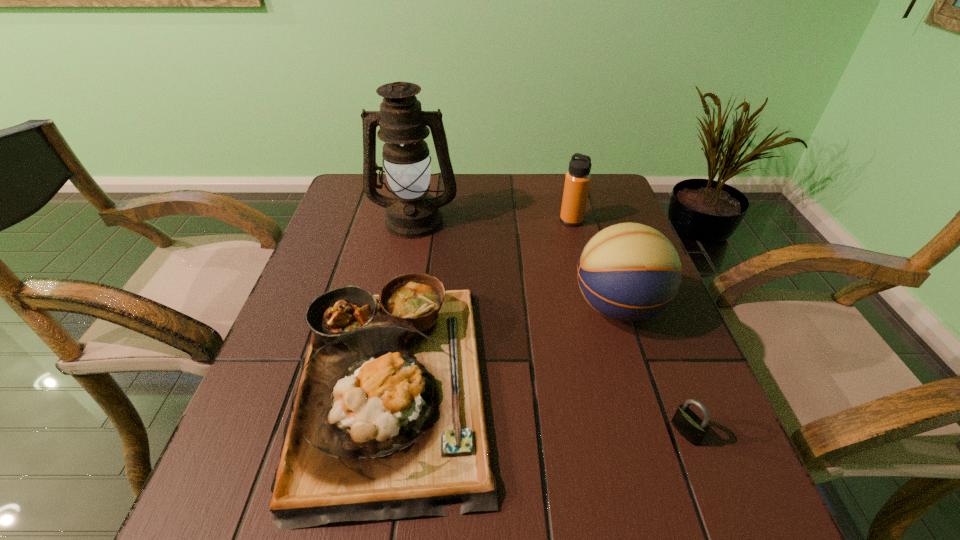
The width and height of the screenshot is (960, 540). What are the coordinates of `free space that satisfies the following two spatial constraints: 1. on the back side of the padlock; 2. on the patterned surface of the basketball` in the screenshot? It's located at (639, 307).

Find the location of `vacant area that satisfies the following two spatial constraints: 1. on the patterned surface of the padlock; 2. on the left side of the basketball`. vacant area that satisfies the following two spatial constraints: 1. on the patterned surface of the padlock; 2. on the left side of the basketball is located at coordinates pyautogui.click(x=658, y=432).

Find the location of `blank space that satisfies the following two spatial constraints: 1. on the back side of the padlock; 2. on the patterned surface of the basketball`. blank space that satisfies the following two spatial constraints: 1. on the back side of the padlock; 2. on the patterned surface of the basketball is located at coordinates (639, 307).

Where is `free space that satisfies the following two spatial constraints: 1. on the patterned surface of the basketball; 2. on the right side of the padlock`? free space that satisfies the following two spatial constraints: 1. on the patterned surface of the basketball; 2. on the right side of the padlock is located at coordinates (658, 432).

Where is `vacant space that satisfies the following two spatial constraints: 1. on the front side of the platter; 2. on the left side of the oil lamp`? vacant space that satisfies the following two spatial constraints: 1. on the front side of the platter; 2. on the left side of the oil lamp is located at coordinates (383, 382).

You are a GUI agent. You are given a task and a screenshot of the screen. Output one action in this format:
    pyautogui.click(x=<x>, y=<y>)
    Task: Click on the vacant point that satisfies the following two spatial constraints: 1. on the front side of the padlock; 2. on the left side of the thermos bottle
    The image size is (960, 540).
    Given the screenshot: What is the action you would take?
    pyautogui.click(x=628, y=432)